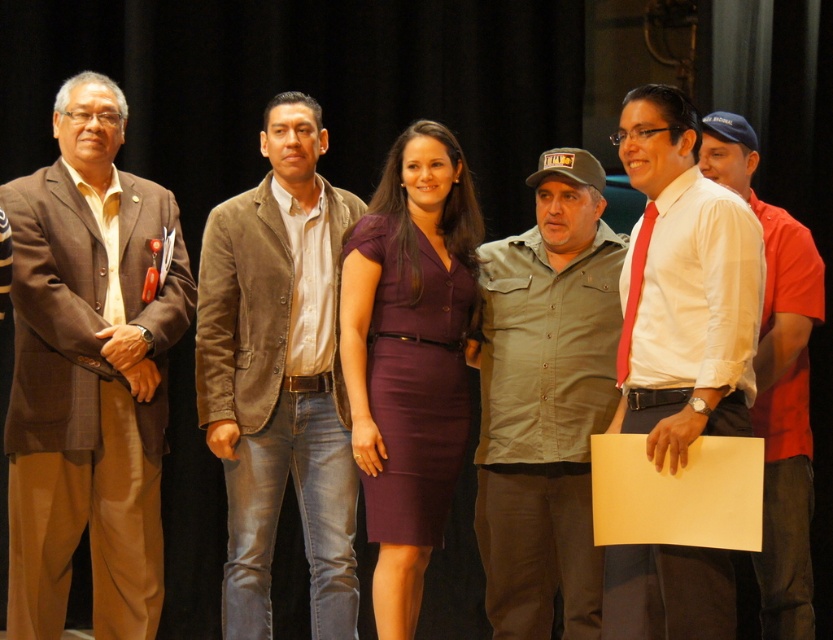
Question: Which object appears farthest from the camera in this image?

Choices:
 (A) purple matte dress at center
 (B) suede jacket at center

Answer: (B)

Question: Which point is farther to the camera?

Choices:
 (A) white shirt at right
 (B) brown leather jacket at left

Answer: (B)

Question: Does white smooth shirt at center appear over purple matte dress at center?

Choices:
 (A) yes
 (B) no

Answer: (A)

Question: Is white smooth shirt at center to the left of white shirt at right from the viewer's perspective?

Choices:
 (A) no
 (B) yes

Answer: (B)

Question: Among these objects, which one is farthest from the camera?

Choices:
 (A) suede jacket at center
 (B) khaki button-up shirt at center

Answer: (A)

Question: In this image, where is suede jacket at center located relative to khaki button-up shirt at center?

Choices:
 (A) above
 (B) below

Answer: (A)